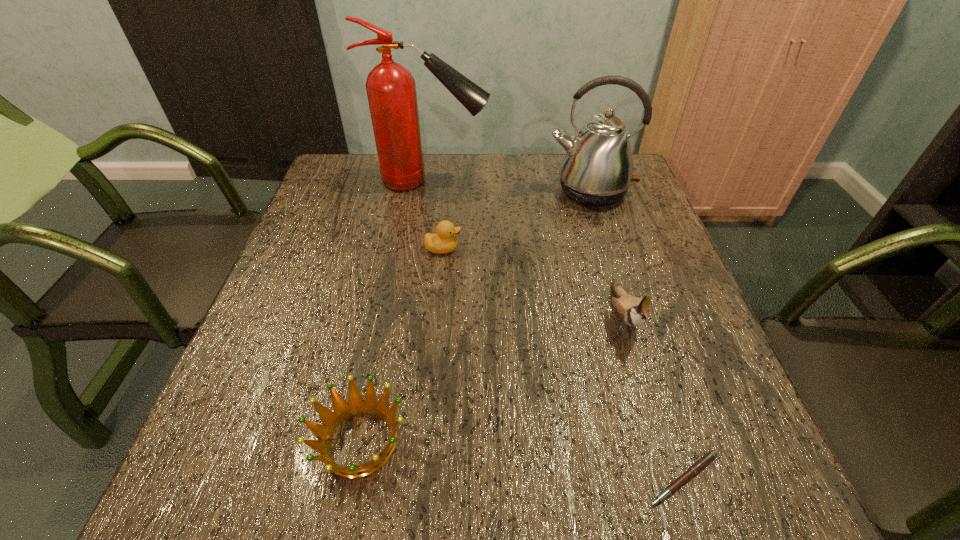
Where is `free space between the duckling and the tallest object`? Image resolution: width=960 pixels, height=540 pixels. free space between the duckling and the tallest object is located at coordinates (437, 214).

I want to click on free point between the shortest object and the bird, so click(x=653, y=397).

Find the location of a particular element. The image size is (960, 540). empty space that is in between the duckling and the third nearest object is located at coordinates (533, 282).

The image size is (960, 540). Identify the location of free space between the third nearest object and the duckling. (533, 282).

This screenshot has height=540, width=960. I want to click on vacant space that's between the tallest object and the fourth nearest object, so click(437, 214).

At what (x,y) coordinates should I click in order to perform the action: click on vacant area between the shortest object and the third tallest object. Please return your answer as a coordinate pair (x, y). Looking at the image, I should click on (653, 397).

Locate an element on the screen. The width and height of the screenshot is (960, 540). unoccupied area between the crown and the tallest object is located at coordinates (396, 311).

You are a GUI agent. You are given a task and a screenshot of the screen. Output one action in this format:
    pyautogui.click(x=<x>, y=<y>)
    Task: Click on the free space between the crown and the kettle
    The width and height of the screenshot is (960, 540).
    Given the screenshot: What is the action you would take?
    pyautogui.click(x=475, y=316)

The width and height of the screenshot is (960, 540). In order to click on the third closest object to the tallest object in this screenshot , I will do `click(634, 311)`.

At what (x,y) coordinates should I click in order to perform the action: click on object identified as the fifth closest to the duckling. Please return your answer as a coordinate pair (x, y). The image size is (960, 540). Looking at the image, I should click on pyautogui.click(x=706, y=459).